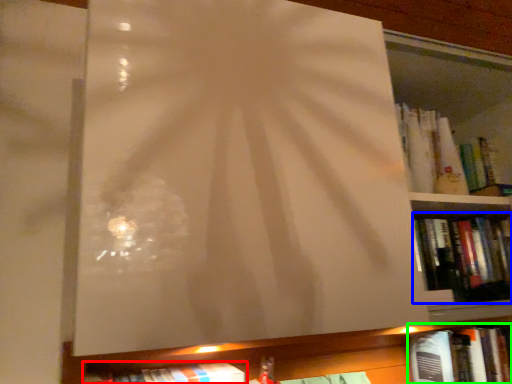
Question: Estimate the real-world distances between objects in this image. Which object is farther from book (highlighted by a red box), book (highlighted by a blue box) or book (highlighted by a green box)?

Choices:
 (A) book
 (B) book

Answer: (B)